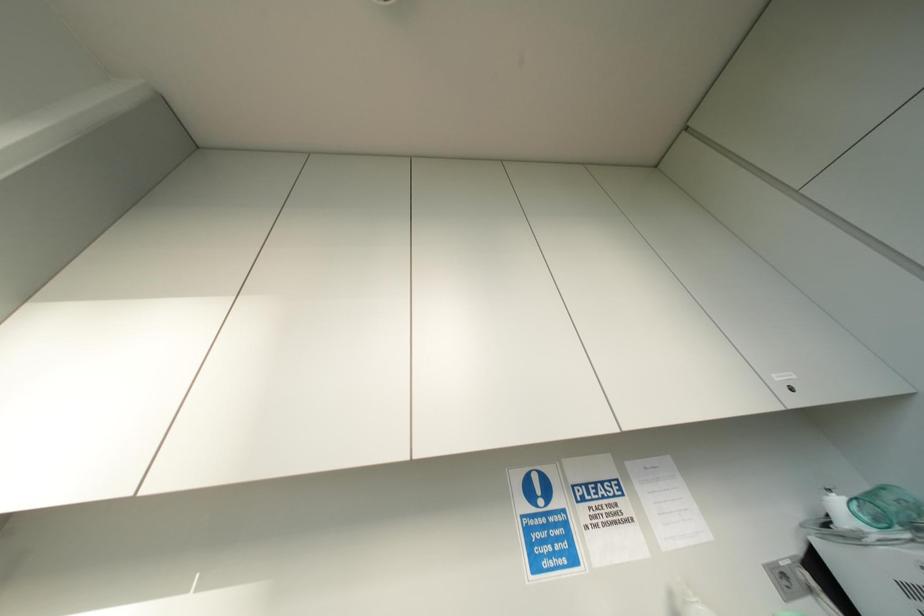
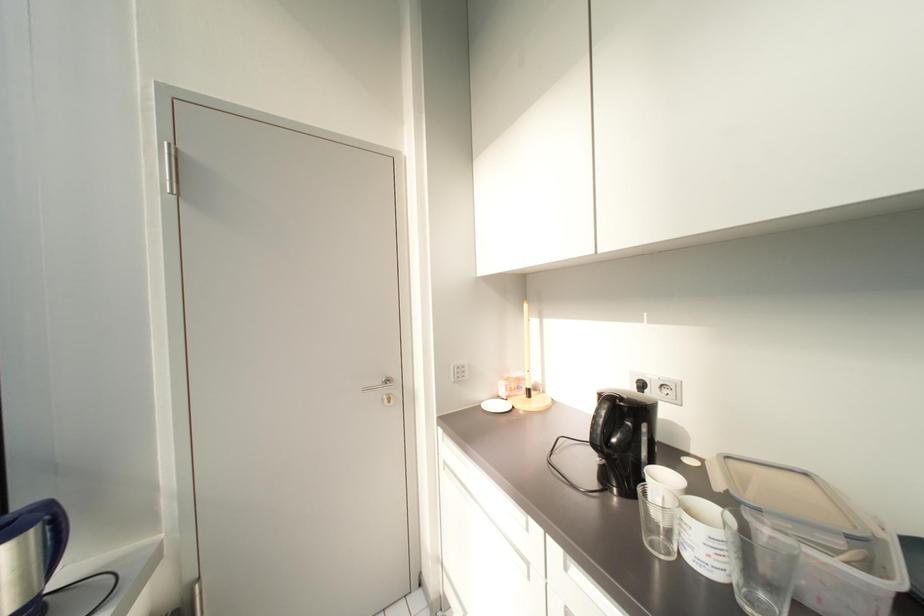
Based on the photo, first-person continuous shooting, in which direction is the camera rotating?

The camera's rotation is toward left-down.